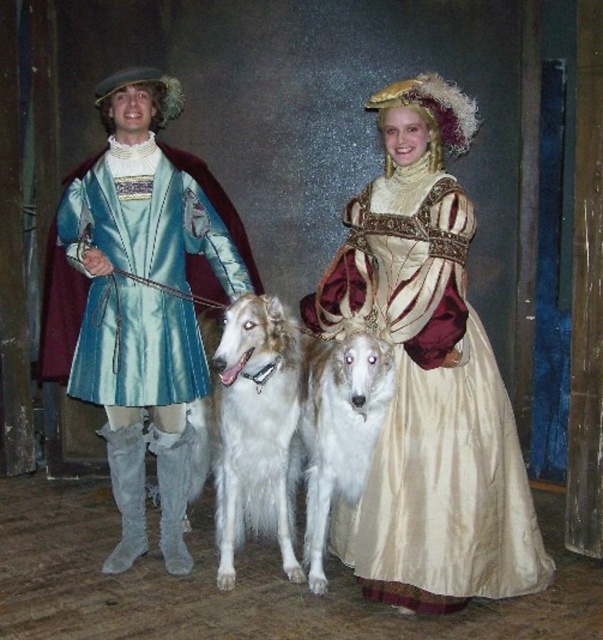
Question: Can you confirm if white fluffy dog at center is wider than white fur dog at center?

Choices:
 (A) yes
 (B) no

Answer: (A)

Question: Which object is positioned farthest from the silky gold dress at center?

Choices:
 (A) silky blue coat at center
 (B) white fur dog at center
 (C) satin blue coat at left
 (D) white fluffy dog at center

Answer: (C)

Question: Which point is farther to the camera?

Choices:
 (A) (314, 456)
 (B) (443, 410)

Answer: (A)

Question: Is white fluffy dog at center to the left of white fur dog at center from the viewer's perspective?

Choices:
 (A) no
 (B) yes

Answer: (B)

Question: Which point is farther to the camera?

Choices:
 (A) white fur dog at center
 (B) white fluffy dog at center
 (C) silky gold dress at center
 (D) silky blue coat at center

Answer: (D)

Question: Can you confirm if silky blue coat at center is positioned to the left of silky gold dress at center?

Choices:
 (A) yes
 (B) no

Answer: (B)